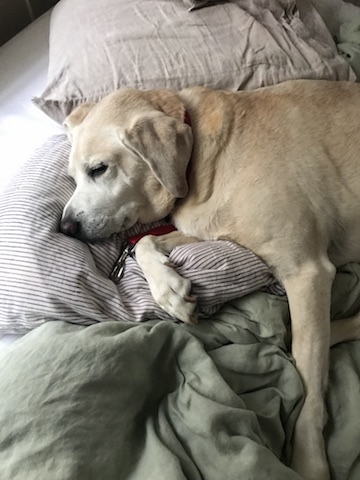
Where is `solid colored pillow`? solid colored pillow is located at coordinates (184, 56).